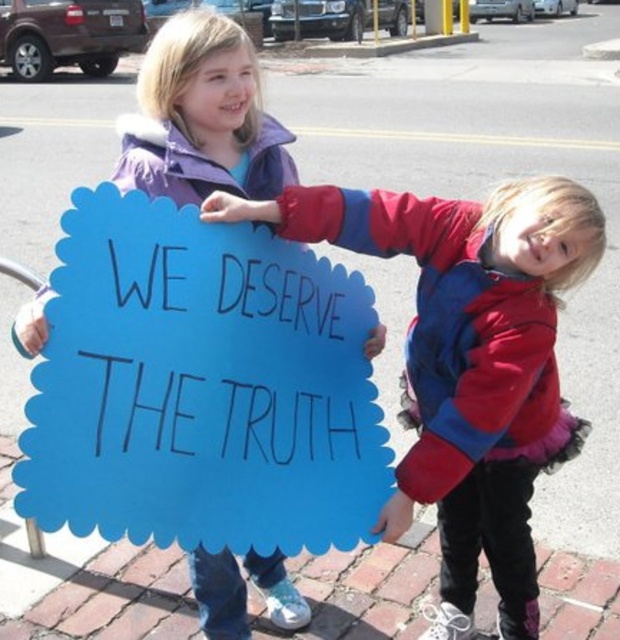
Question: Observing the image, what is the correct spatial positioning of blue paper sign at center in reference to blue cardboard sign at center?

Choices:
 (A) right
 (B) left

Answer: (B)

Question: Among these points, which one is farthest from the camera?

Choices:
 (A) (306, 337)
 (B) (513, 323)

Answer: (A)

Question: Is blue paper sign at center wider than blue cardboard sign at center?

Choices:
 (A) yes
 (B) no

Answer: (B)

Question: Does blue paper sign at center appear on the right side of blue cardboard sign at center?

Choices:
 (A) no
 (B) yes

Answer: (A)

Question: Which object is farther from the camera taking this photo?

Choices:
 (A) blue cardboard sign at center
 (B) blue paper sign at center

Answer: (A)

Question: Which object appears closest to the camera in this image?

Choices:
 (A) blue paper sign at center
 (B) blue cardboard sign at center

Answer: (A)